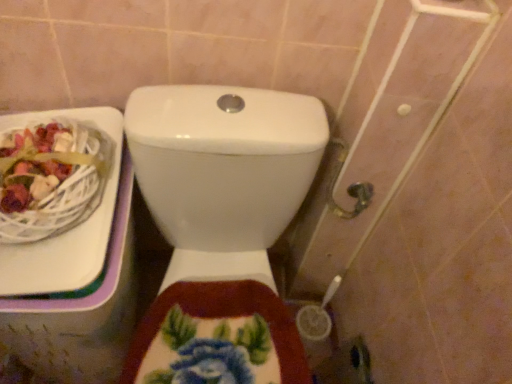
Question: Should I look upward or downward to see white glossy toilet at center?

Choices:
 (A) down
 (B) up

Answer: (A)

Question: Is white wicker basket at upper left oriented towards white glossy toilet at center?

Choices:
 (A) yes
 (B) no

Answer: (B)

Question: Can you confirm if white wicker basket at upper left is thinner than white glossy toilet at center?

Choices:
 (A) yes
 (B) no

Answer: (A)

Question: Is white wicker basket at upper left further to the viewer compared to white glossy toilet at center?

Choices:
 (A) yes
 (B) no

Answer: (A)

Question: From a real-world perspective, is white wicker basket at upper left physically above white glossy toilet at center?

Choices:
 (A) no
 (B) yes

Answer: (B)

Question: Does white wicker basket at upper left have a greater height compared to white glossy toilet at center?

Choices:
 (A) no
 (B) yes

Answer: (A)

Question: From a real-world perspective, is white wicker basket at upper left positioned under white glossy toilet at center based on gravity?

Choices:
 (A) no
 (B) yes

Answer: (A)

Question: Is white glossy toilet at center beside white wicker basket at upper left?

Choices:
 (A) no
 (B) yes

Answer: (A)

Question: Does white glossy toilet at center have a lesser width compared to white wicker basket at upper left?

Choices:
 (A) yes
 (B) no

Answer: (B)

Question: Is white wicker basket at upper left surrounded by white glossy toilet at center?

Choices:
 (A) yes
 (B) no

Answer: (B)

Question: Does white glossy toilet at center have a greater height compared to white wicker basket at upper left?

Choices:
 (A) no
 (B) yes

Answer: (B)

Question: Considering the relative positions of white glossy toilet at center and white wicker basket at upper left in the image provided, is white glossy toilet at center to the left of white wicker basket at upper left from the viewer's perspective?

Choices:
 (A) no
 (B) yes

Answer: (A)

Question: Is white glossy toilet at center bigger than white wicker basket at upper left?

Choices:
 (A) yes
 (B) no

Answer: (A)

Question: From the image's perspective, is white wicker basket at upper left located above or below white glossy toilet at center?

Choices:
 (A) above
 (B) below

Answer: (A)